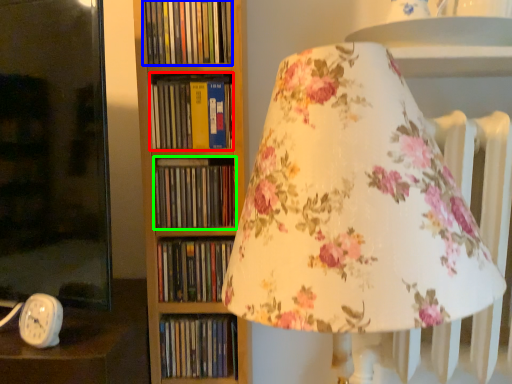
Question: Based on their relative distances, which object is nearer to book (highlighted by a red box)? Choose from book (highlighted by a blue box) and book (highlighted by a green box).

Choices:
 (A) book
 (B) book

Answer: (B)